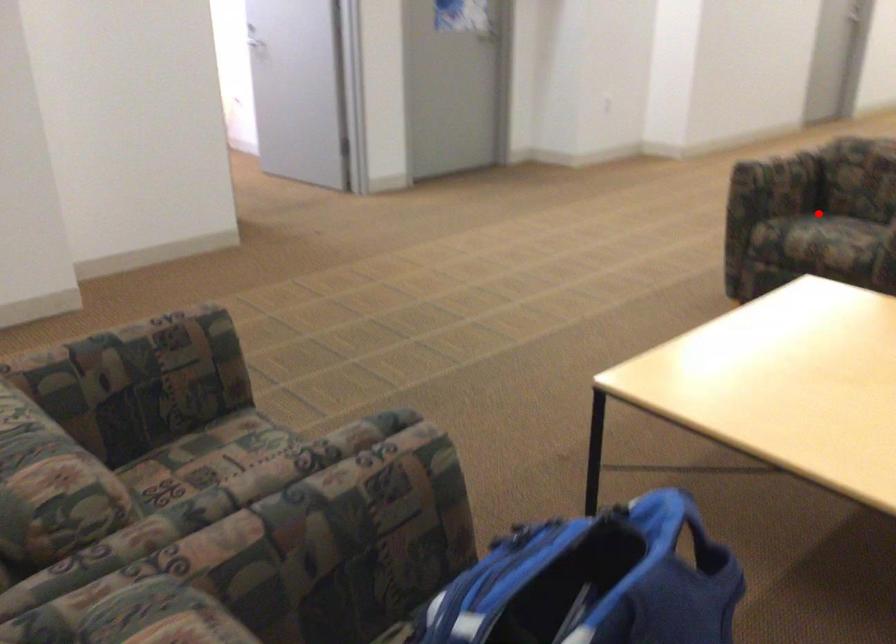
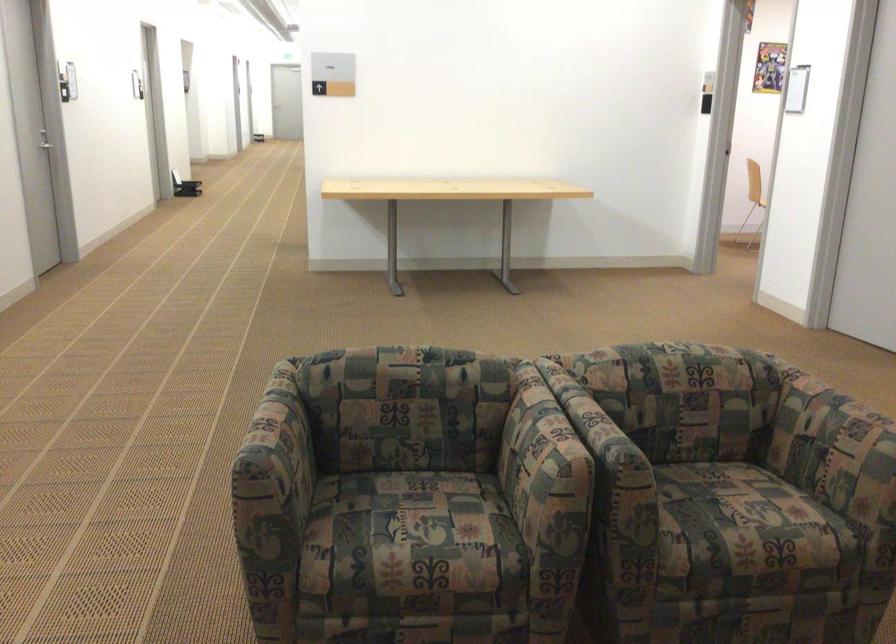
Where in the second image is the point corresponding to the highlighted location from the first image?

(417, 521)